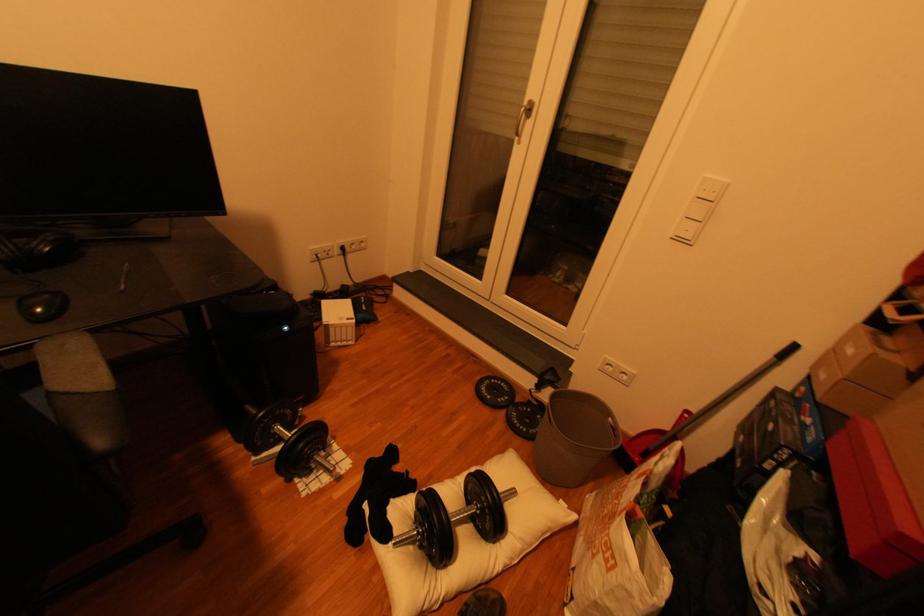
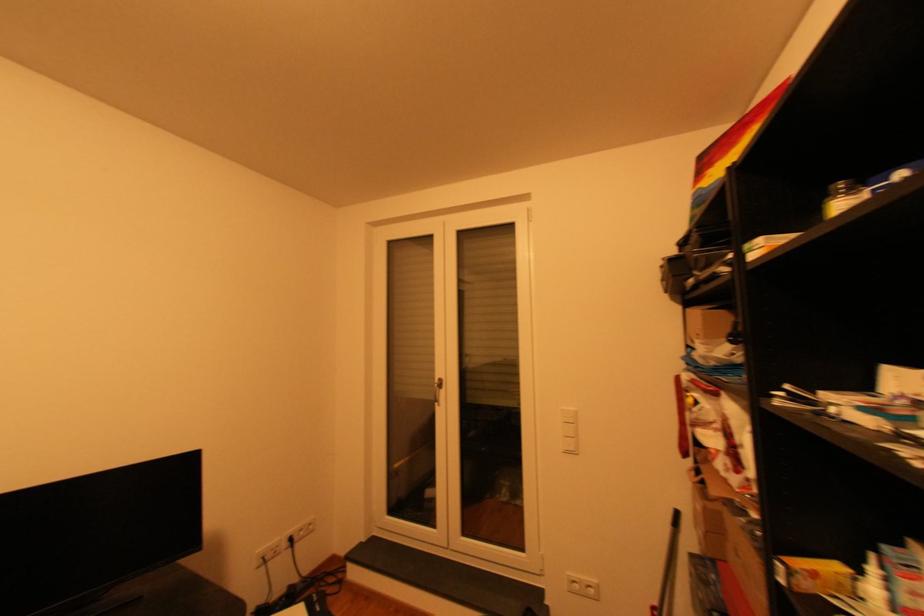
Locate, in the second image, the point that corresponds to (x=697, y=411) in the first image.

(662, 608)